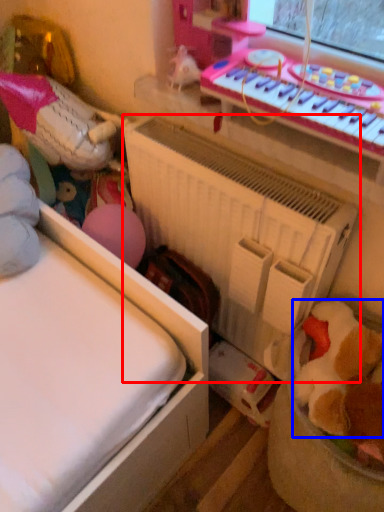
Question: Which object appears closest to the camera in this image, radiator (highlighted by a red box) or toy (highlighted by a blue box)?

Choices:
 (A) radiator
 (B) toy

Answer: (B)